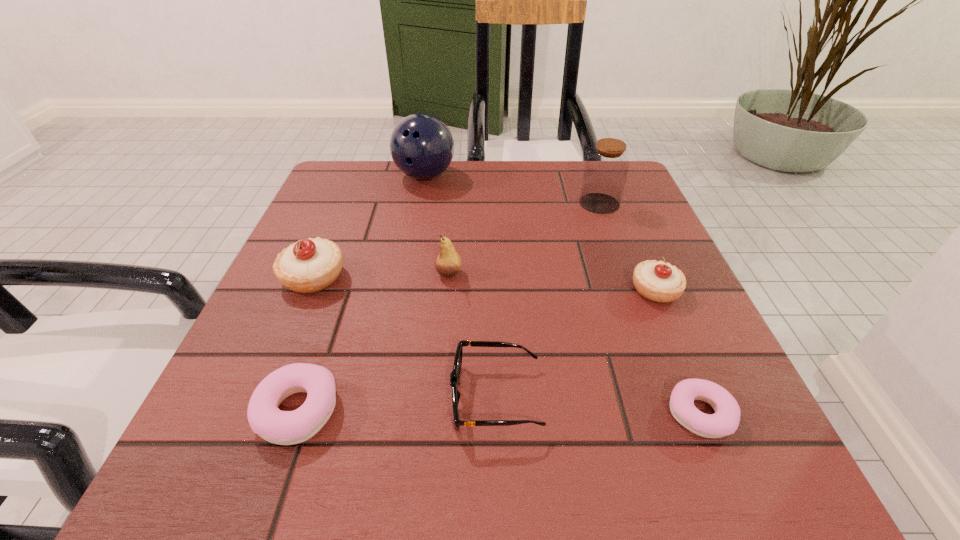
Find the location of a particular element. The height and width of the screenshot is (540, 960). free region located on the front-facing side of the sunglasses is located at coordinates (326, 397).

The width and height of the screenshot is (960, 540). I want to click on free region located on the front-facing side of the sunglasses, so [353, 397].

The width and height of the screenshot is (960, 540). Find the location of `free space located on the back of the left pink pastry`. free space located on the back of the left pink pastry is located at coordinates (338, 292).

What are the coordinates of `free space located 0.160m on the left of the shortest object` in the screenshot? It's located at (553, 414).

Where is `bowling ball present at the far edge`? bowling ball present at the far edge is located at coordinates (421, 145).

Find the location of `jar present at the far edge`. jar present at the far edge is located at coordinates pyautogui.click(x=606, y=169).

The height and width of the screenshot is (540, 960). What are the coordinates of `sunglasses present at the near edge` in the screenshot? It's located at (455, 374).

Find the location of `jar that is at the right edge`. jar that is at the right edge is located at coordinates pyautogui.click(x=606, y=169).

Where is `object that is at the near left corner`? The width and height of the screenshot is (960, 540). object that is at the near left corner is located at coordinates (265, 418).

Identify the location of object present at the far right corner. The width and height of the screenshot is (960, 540). (606, 169).